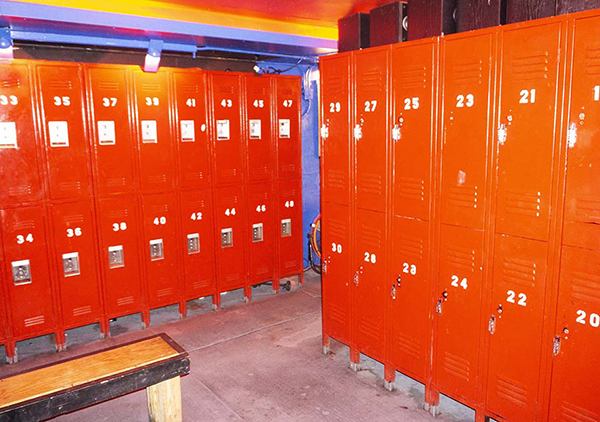
The image size is (600, 422). I want to click on gray area under lockers, so click(405, 382), click(154, 314).